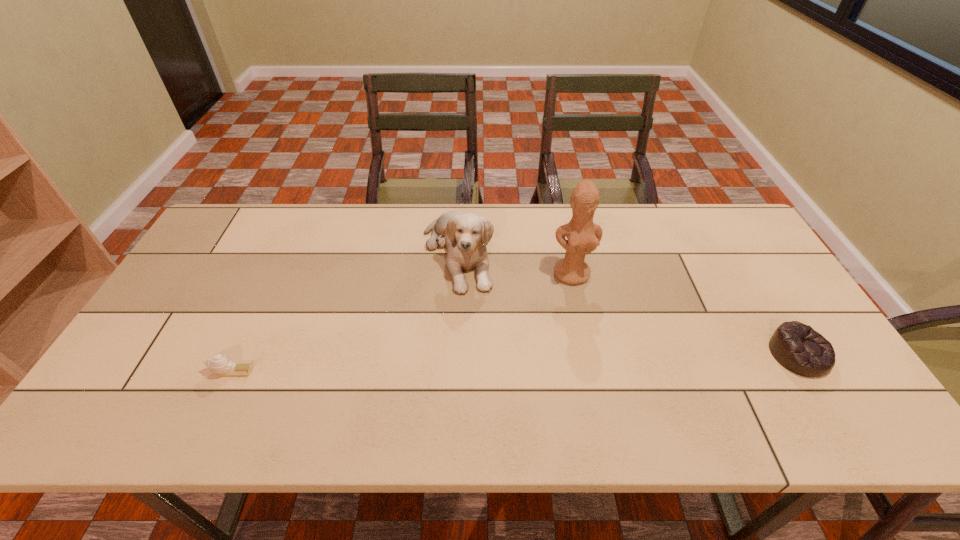
Locate an element on the screen. The image size is (960, 540). the shortest object is located at coordinates (221, 364).

Find the location of a particular element. This screenshot has height=540, width=960. the leftmost object is located at coordinates (221, 364).

What are the coordinates of `beanbag` in the screenshot? It's located at (797, 347).

This screenshot has width=960, height=540. What are the coordinates of `the rightmost object` in the screenshot? It's located at (797, 347).

Find the location of a particular element. Image resolution: width=960 pixels, height=540 pixels. the third object from right to left is located at coordinates (466, 235).

You are a GUI agent. You are given a task and a screenshot of the screen. Output one action in this format:
    pyautogui.click(x=<x>, y=<y>)
    Task: Click on the third shortest object
    
    Given the screenshot: What is the action you would take?
    coord(466,235)

Locate an element on the screen. The image size is (960, 540). the tallest object is located at coordinates (583, 236).

This screenshot has height=540, width=960. Find the location of `the second object from right to left`. the second object from right to left is located at coordinates (583, 236).

At what (x,y) coordinates should I click in order to perform the action: click on free point located on the shell of the shortest object. Please return your answer as a coordinate pair (x, y). The width and height of the screenshot is (960, 540). Looking at the image, I should click on (x=134, y=370).

Where is `free region located 0.190m on the shell of the shortest object`? The height and width of the screenshot is (540, 960). free region located 0.190m on the shell of the shortest object is located at coordinates (130, 370).